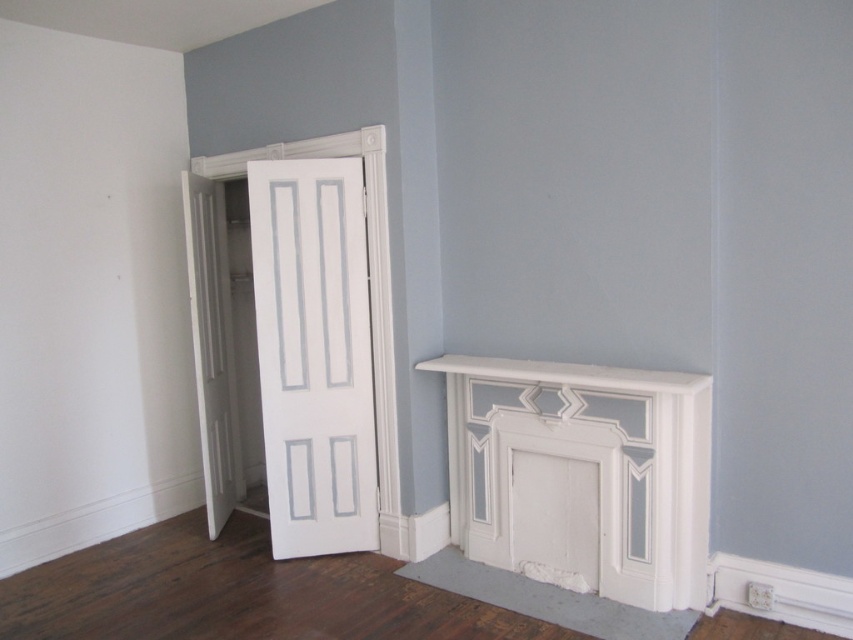
Question: Is white painted wood fireplace at lower right positioned at the back of white painted wood mantle at lower right?

Choices:
 (A) yes
 (B) no

Answer: (A)

Question: Among these points, which one is nearest to the camera?

Choices:
 (A) tap(563, 365)
 (B) tap(653, 593)

Answer: (B)

Question: Among these points, which one is nearest to the camera?

Choices:
 (A) (682, 412)
 (B) (566, 369)

Answer: (A)

Question: Is white painted wood fireplace at lower right to the right of white painted wood mantle at lower right from the viewer's perspective?

Choices:
 (A) yes
 (B) no

Answer: (A)

Question: From the image, what is the correct spatial relationship of white painted wood fireplace at lower right in relation to white painted wood mantle at lower right?

Choices:
 (A) below
 (B) above

Answer: (A)

Question: Which object is farther from the camera taking this photo?

Choices:
 (A) white painted wood mantle at lower right
 (B) white painted wood fireplace at lower right

Answer: (B)